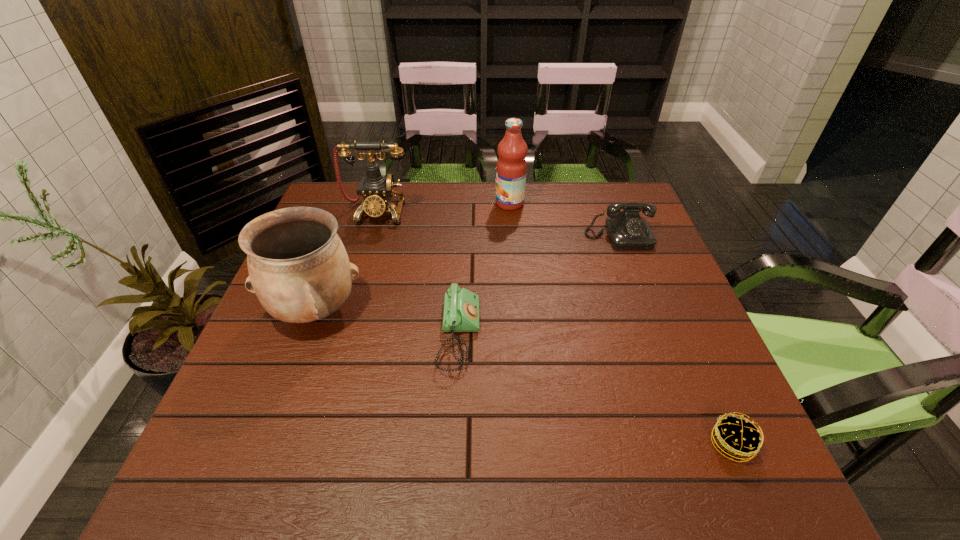
In the image, there is a desktop. In order to click on free space at the near left corner in this screenshot , I will do `click(228, 448)`.

This screenshot has height=540, width=960. In order to click on free spot between the fruit juice and the fourth tallest object in this screenshot , I will do `click(564, 220)`.

Where is `free point between the tallest telephone and the fourth tallest object`? This screenshot has height=540, width=960. free point between the tallest telephone and the fourth tallest object is located at coordinates (499, 224).

Identify the location of free point between the tallest telephone and the nearest telephone. The width and height of the screenshot is (960, 540). (419, 274).

The height and width of the screenshot is (540, 960). Find the location of `empty location between the fruit juice and the urn`. empty location between the fruit juice and the urn is located at coordinates (413, 257).

Where is `vacant point located between the third shortest object and the fruit juice`? vacant point located between the third shortest object and the fruit juice is located at coordinates (564, 220).

What are the coordinates of `free space between the tallest telephone and the patty` in the screenshot? It's located at (555, 328).

Find the location of a particular element. vacant region between the second telephone from right to left and the nearest object is located at coordinates (595, 389).

Find the location of `free space between the tallest telephone and the fourth object from left to right`. free space between the tallest telephone and the fourth object from left to right is located at coordinates (444, 208).

Image resolution: width=960 pixels, height=540 pixels. Find the location of `empty space between the leftmost telephone and the nearest object`. empty space between the leftmost telephone and the nearest object is located at coordinates (555, 328).